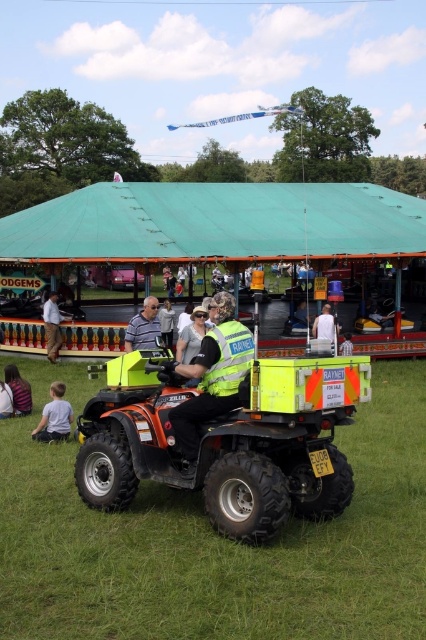
Can you confirm if reflective yellow vest at center is wider than brown fabric pants at lower left?

Correct, the width of reflective yellow vest at center exceeds that of brown fabric pants at lower left.

Who is more distant from viewer, [235,369] or [51,296]?

Point [51,296]

Where is `reflective yellow vest at center`? Image resolution: width=426 pixels, height=640 pixels. reflective yellow vest at center is located at coordinates click(x=213, y=376).

Locate an element on the screen. This screenshot has height=640, width=426. green fabric canopy at center is located at coordinates (216, 224).

You are a GUI agent. You are given a task and a screenshot of the screen. Output one action in this format:
    pyautogui.click(x=<x>, y=<y>)
    Task: Click on the green fabric canopy at center
    
    Given the screenshot: What is the action you would take?
    pyautogui.click(x=216, y=224)

Can you confirm if matte gray shirt at center is smaller than brown fabric pants at lower left?

No, matte gray shirt at center is not smaller than brown fabric pants at lower left.

Can you confirm if matte gray shirt at center is taller than brown fabric pants at lower left?

No, matte gray shirt at center is not taller than brown fabric pants at lower left.

Is point (129, 340) in front of point (54, 305)?

Yes.

Identify the location of matte gray shirt at center. (143, 326).